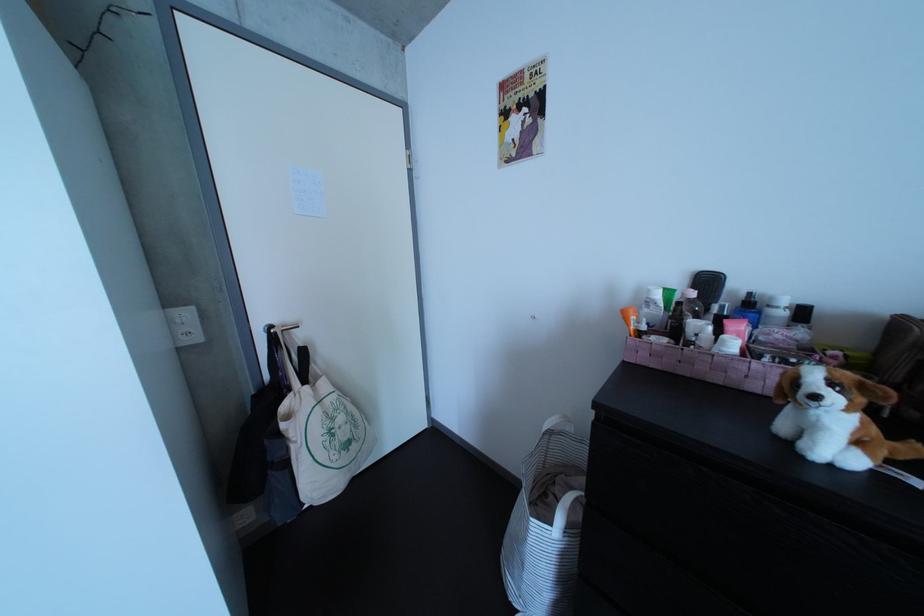
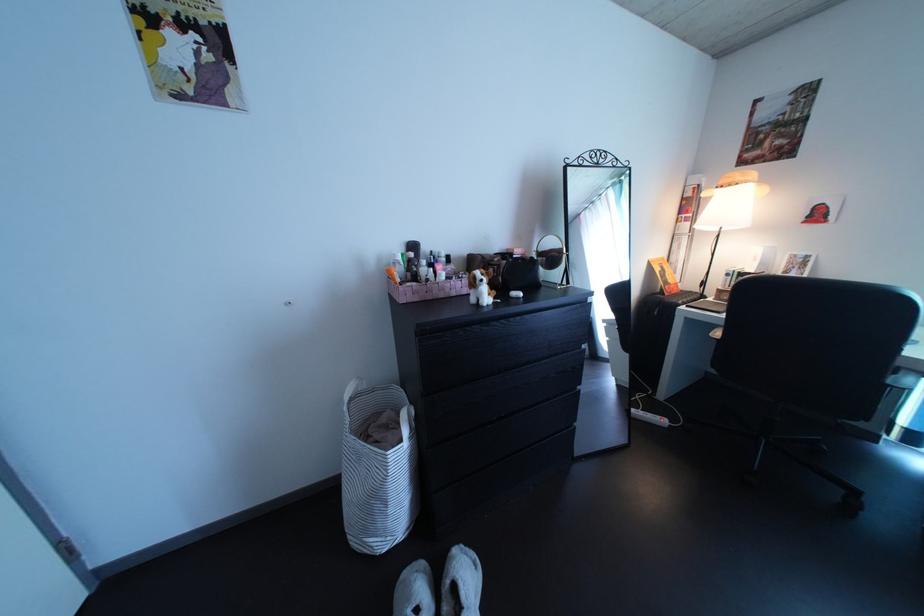
Locate, in the second image, the point that corresponds to (x=809, y=389) in the first image.

(489, 286)